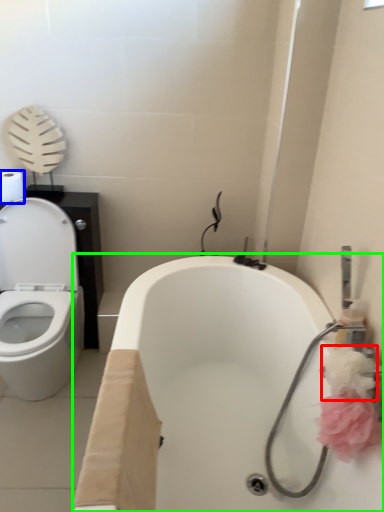
Question: Which object is the closest to the flower (highlighted by a red box)? Choose among these: toilet paper (highlighted by a blue box) or bath (highlighted by a green box).

Choices:
 (A) toilet paper
 (B) bath

Answer: (B)